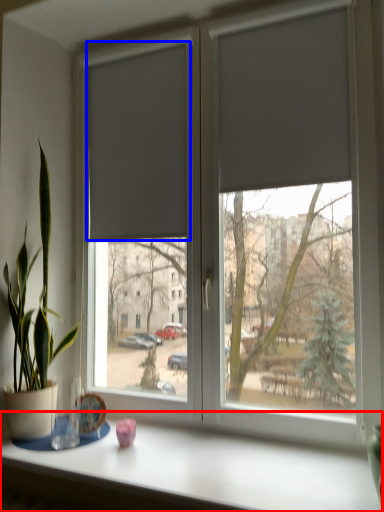
Question: Which of the following is the closest to the observer, table (highlighted by a red box) or curtain (highlighted by a blue box)?

Choices:
 (A) table
 (B) curtain

Answer: (A)